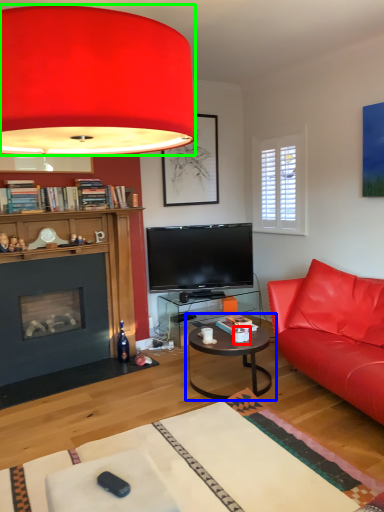
Question: Which object is the closest to the coffee cup (highlighted by a red box)? Choose among these: coffee table (highlighted by a blue box) or lamp (highlighted by a green box).

Choices:
 (A) coffee table
 (B) lamp

Answer: (A)